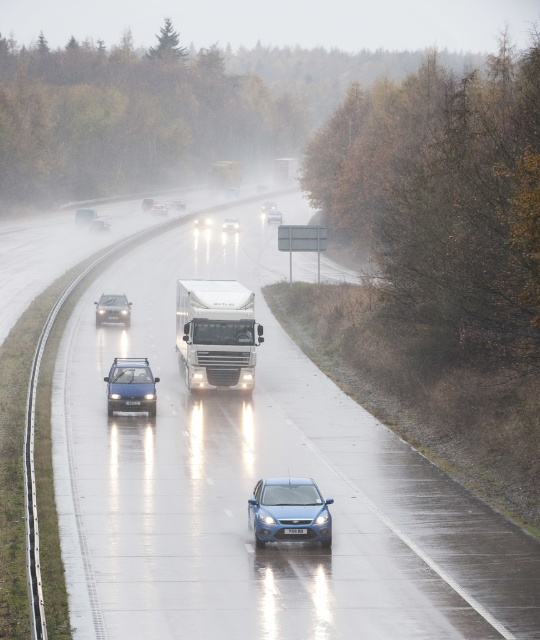
Question: Does white glossy trailer truck at center appear on the left side of shiny silver sedan at center?

Choices:
 (A) yes
 (B) no

Answer: (B)

Question: Estimate the real-world distances between objects in this image. Which object is closer to the satin silver convertible at center?

Choices:
 (A) white glossy truck at center
 (B) white glossy trailer truck at center
 (C) glossy white truck at center
 (D) white plastic license plate at center

Answer: (B)

Question: Which object appears closest to the camera in this image?

Choices:
 (A) satin blue sedan at center
 (B) blue matte hatchback at center
 (C) glossy metallic car at center

Answer: (C)

Question: Which of the following is the closest to the observer?

Choices:
 (A) glossy metallic car at center
 (B) satin blue sedan at center
 (C) shiny silver sedan at center

Answer: (A)

Question: Does white glossy trailer truck at center come behind satin blue sedan at center?

Choices:
 (A) no
 (B) yes

Answer: (B)

Question: Is satin blue sedan at center closer to camera compared to shiny silver sedan at center?

Choices:
 (A) yes
 (B) no

Answer: (A)